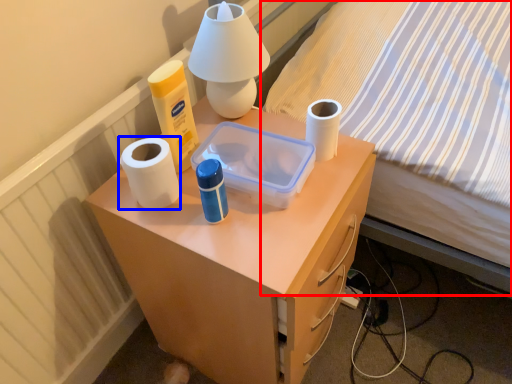
Question: Which point is further to the camera, bed (highlighted by a red box) or paper towel (highlighted by a blue box)?

Choices:
 (A) bed
 (B) paper towel

Answer: (B)